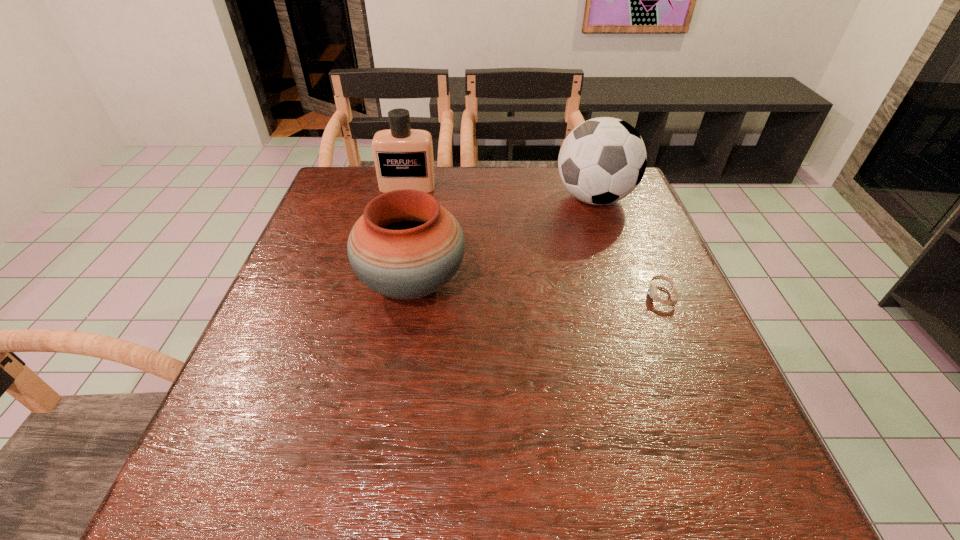
Locate an element on the screen. soccer ball is located at coordinates tap(602, 160).

Locate an element on the screen. Image resolution: width=960 pixels, height=540 pixels. perfume is located at coordinates (403, 157).

Find the location of a particular element. This screenshot has height=540, width=960. pottery is located at coordinates (405, 245).

Locate an element on the screen. This screenshot has height=540, width=960. the shortest object is located at coordinates [652, 289].

I want to click on vacant space located 0.170m on the main logo of the soccer ball, so click(x=494, y=198).

Find the location of a particular element. The width and height of the screenshot is (960, 540). vacant region located on the main logo of the soccer ball is located at coordinates (459, 198).

You are a GUI agent. You are given a task and a screenshot of the screen. Output one action in this format:
    pyautogui.click(x=<x>, y=<y>)
    Task: Click on the vacant area located 0.350m on the main logo of the soccer ball
    This screenshot has width=960, height=540.
    Given the screenshot: What is the action you would take?
    tap(431, 198)

Locate an element on the screen. The height and width of the screenshot is (540, 960). vacant space located 0.210m on the front label of the perfume is located at coordinates (396, 239).

The width and height of the screenshot is (960, 540). Find the location of `blank space located on the right of the pottery`. blank space located on the right of the pottery is located at coordinates (564, 284).

Identify the location of free space located on the face of the watch. (617, 295).